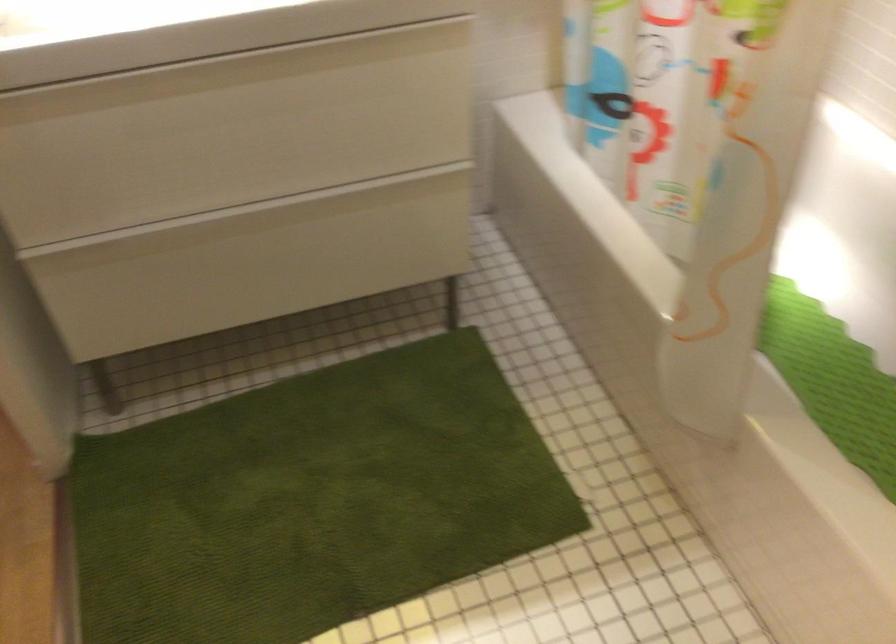
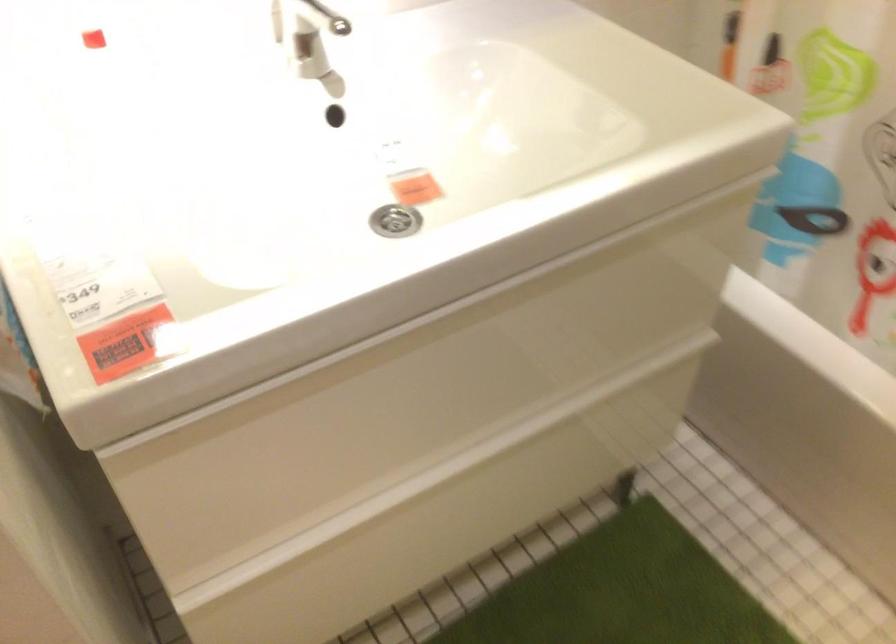
Find the pixel in the second image that matches [190,138] in the first image.

(423, 392)